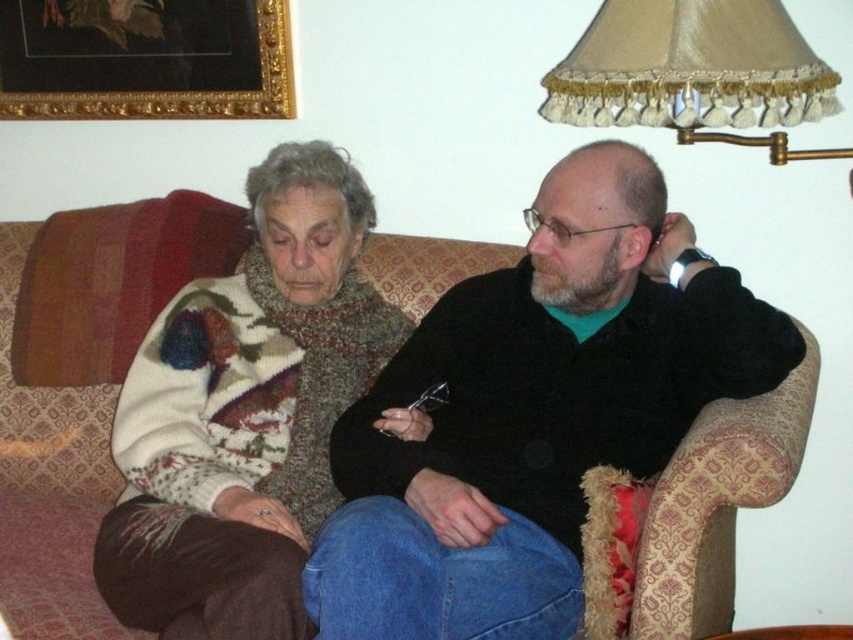
Question: Which point is farther to the camera?

Choices:
 (A) (115, 550)
 (B) (112, 92)
 (C) (654, 8)

Answer: (B)

Question: Can you confirm if black matte jacket at center is positioned to the left of beige satin lampshade at upper right?

Choices:
 (A) yes
 (B) no

Answer: (A)

Question: Can you confirm if knitted sweater at left is positioned above gold-framed picture at upper left?

Choices:
 (A) no
 (B) yes

Answer: (A)

Question: Does knitted sweater at left have a greater width compared to beige satin lampshade at upper right?

Choices:
 (A) yes
 (B) no

Answer: (B)

Question: Which object appears farthest from the camera in this image?

Choices:
 (A) gold-framed picture at upper left
 (B) black matte jacket at center
 (C) beige satin lampshade at upper right
 (D) knitted sweater at left

Answer: (A)

Question: Which of the following is the farthest from the observer?

Choices:
 (A) gold-framed picture at upper left
 (B) beige satin lampshade at upper right
 (C) black matte jacket at center
 (D) knitted sweater at left

Answer: (A)